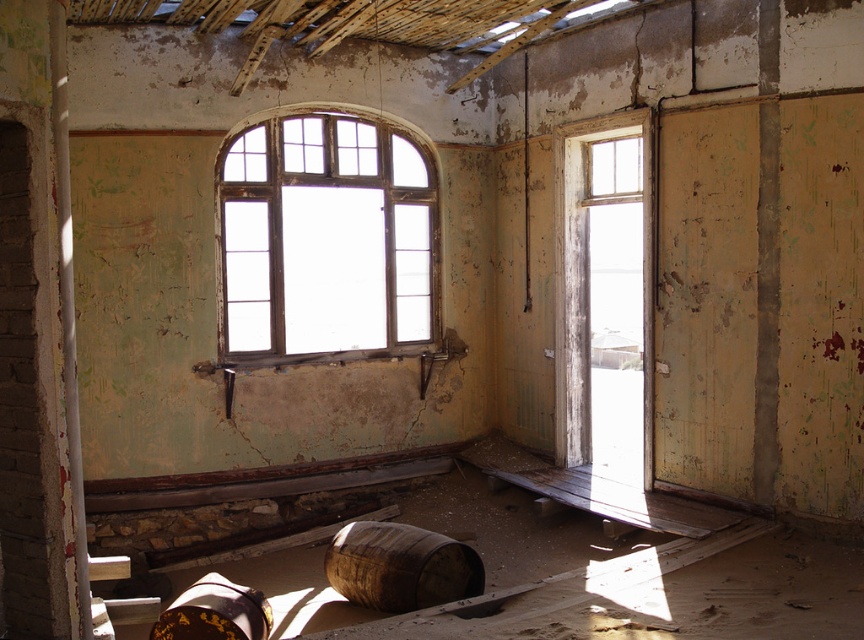
Question: Does white painted wood at left have a larger size compared to brown wooden barrel at lower center?

Choices:
 (A) no
 (B) yes

Answer: (A)

Question: Which object appears farthest from the camera in this image?

Choices:
 (A) brown wooden barrel at center
 (B) brown wooden barrel at lower center
 (C) white painted wood at left
 (D) wooden frame window at center

Answer: (D)

Question: Which of the following is the closest to the observer?

Choices:
 (A) white painted wood at left
 (B) brown wooden barrel at center
 (C) brown wooden barrel at lower center

Answer: (A)

Question: Does wooden frame window at center have a greater width compared to brown wooden barrel at center?

Choices:
 (A) yes
 (B) no

Answer: (A)

Question: Does wooden frame window at center have a larger size compared to brown wooden barrel at center?

Choices:
 (A) yes
 (B) no

Answer: (A)

Question: Which of the following is the closest to the observer?

Choices:
 (A) white painted wood at left
 (B) wooden frame window at center

Answer: (A)